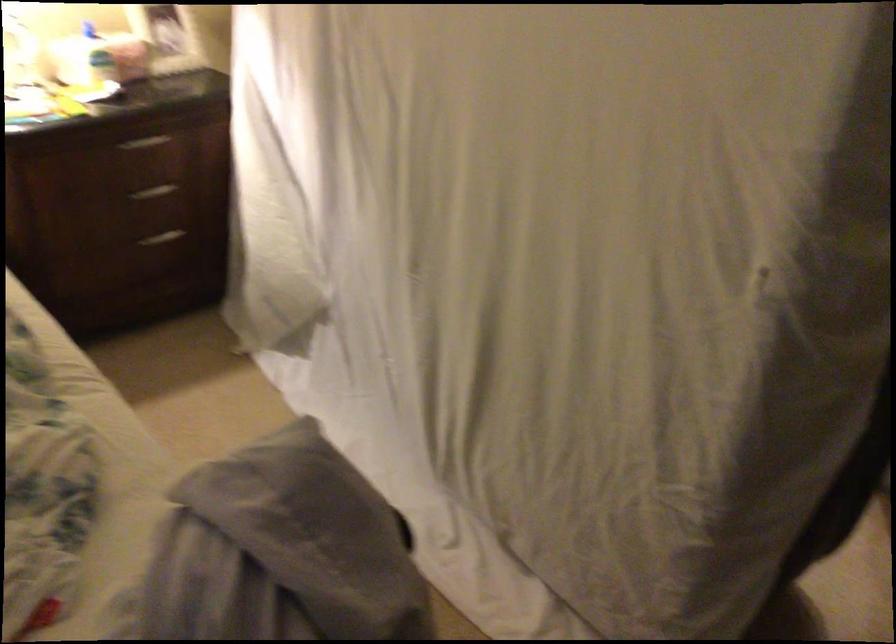
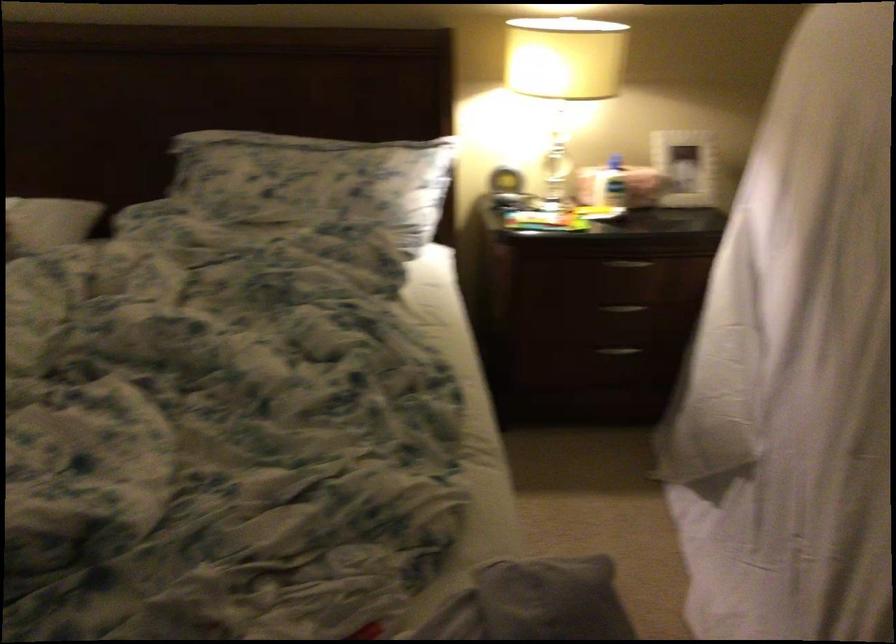
Locate, in the second image, the point that corresponds to point 153,198 in the first image.

(624, 308)